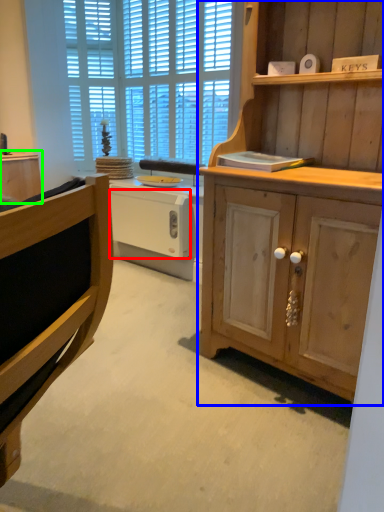
Question: Which object is the farthest from drawer (highlighted by a red box)? Choose among these: cabinetry (highlighted by a blue box) or cabinetry (highlighted by a green box).

Choices:
 (A) cabinetry
 (B) cabinetry

Answer: (A)